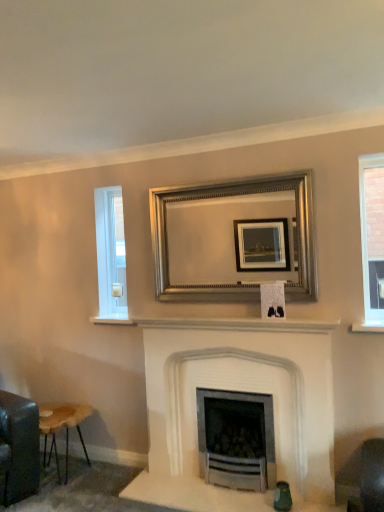
Question: Is wooden stool at lower left further to the viewer compared to white stone fireplace at center?

Choices:
 (A) yes
 (B) no

Answer: (A)

Question: From the image's perspective, would you say wooden stool at lower left is shown under white stone fireplace at center?

Choices:
 (A) no
 (B) yes

Answer: (B)

Question: Could you tell me if wooden stool at lower left is turned towards white stone fireplace at center?

Choices:
 (A) no
 (B) yes

Answer: (B)

Question: Is wooden stool at lower left at the right side of white stone fireplace at center?

Choices:
 (A) no
 (B) yes

Answer: (A)

Question: Does wooden stool at lower left have a greater height compared to white stone fireplace at center?

Choices:
 (A) yes
 (B) no

Answer: (B)

Question: Can you confirm if wooden stool at lower left is positioned to the left of white stone fireplace at center?

Choices:
 (A) no
 (B) yes

Answer: (B)

Question: Is white glass window at left, which is the 1th window in back-to-front order, at the left side of silver/golden metallic picture frame at center?

Choices:
 (A) yes
 (B) no

Answer: (A)

Question: Is the surface of white glass window at left, which is the 1th window in back-to-front order, in direct contact with silver/golden metallic picture frame at center?

Choices:
 (A) no
 (B) yes

Answer: (A)

Question: Is white glass window at left, which is the second window from front to back, positioned in front of silver/golden metallic picture frame at center?

Choices:
 (A) yes
 (B) no

Answer: (B)

Question: Is white glass window at left, which is the 1th window in back-to-front order, further to camera compared to silver/golden metallic picture frame at center?

Choices:
 (A) no
 (B) yes

Answer: (B)

Question: Considering the relative sizes of white glass window at left, which is the second window from front to back, and silver/golden metallic picture frame at center in the image provided, is white glass window at left, which is the second window from front to back, taller than silver/golden metallic picture frame at center?

Choices:
 (A) no
 (B) yes

Answer: (B)

Question: Is white glass window at left, which is the second window in right-to-left order, thinner than silver/golden metallic picture frame at center?

Choices:
 (A) yes
 (B) no

Answer: (A)

Question: From a real-world perspective, is wooden stool at lower left over white glass window at left, which is the second window in right-to-left order?

Choices:
 (A) yes
 (B) no

Answer: (B)